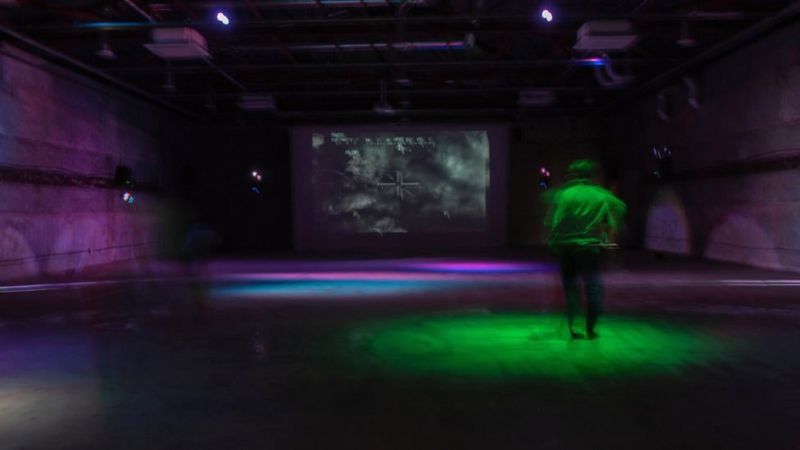
Identify the location of light. (221, 18).